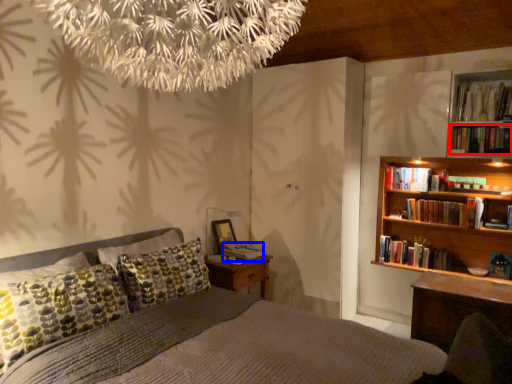
Question: Which object appears farthest to the camera in this image, book (highlighted by a red box) or book (highlighted by a blue box)?

Choices:
 (A) book
 (B) book

Answer: (B)